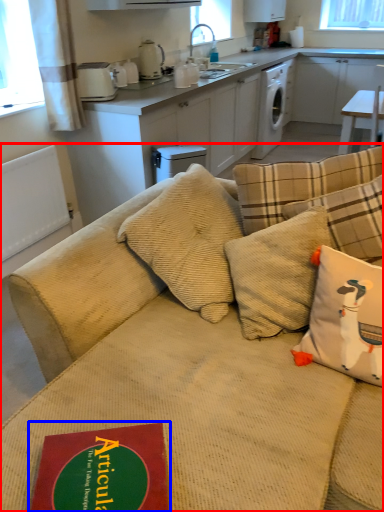
Question: Which object is further to the camera taking this photo, studio couch (highlighted by a red box) or paperback book (highlighted by a blue box)?

Choices:
 (A) studio couch
 (B) paperback book

Answer: (B)